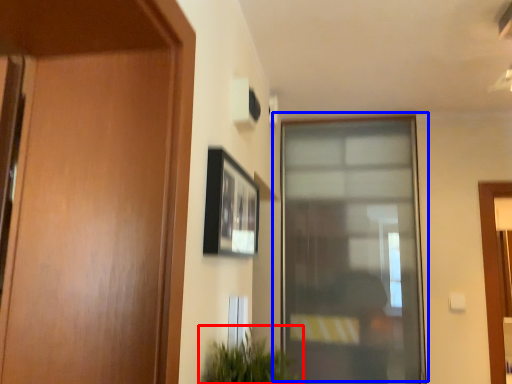
Question: Among these objects, which one is nearest to the camera, houseplant (highlighted by a red box) or window (highlighted by a blue box)?

Choices:
 (A) houseplant
 (B) window

Answer: (A)